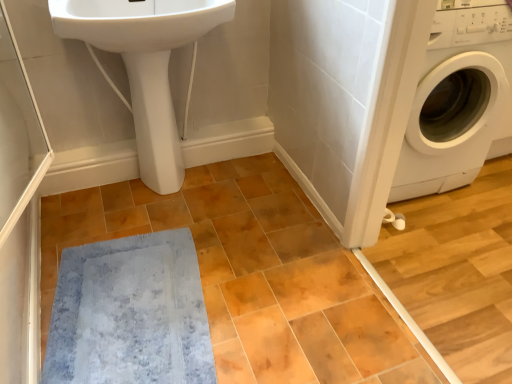
Find the location of a particular element. Image resolution: width=512 pixels, height=384 pixels. white glossy washing machine at right is located at coordinates click(x=457, y=98).

What do you see at coordinates (155, 121) in the screenshot?
I see `white glossy bidet at lower left` at bounding box center [155, 121].

Locate an element on the screen. white glossy washing machine at right is located at coordinates (457, 98).

Between blue plush bath mat at lower left and white glossy bidet at lower left, which one appears on the right side from the viewer's perspective?

white glossy bidet at lower left.

Can you tell me how much blue plush bath mat at lower left and white glossy bidet at lower left differ in facing direction?

They differ by 88.4 degrees in their facing directions.

Considering the sizes of blue plush bath mat at lower left and white glossy bidet at lower left in the image, is blue plush bath mat at lower left bigger or smaller than white glossy bidet at lower left?

In the image, blue plush bath mat at lower left appears to be smaller than white glossy bidet at lower left.

Is blue plush bath mat at lower left taller than white glossy bidet at lower left?

Incorrect, the height of blue plush bath mat at lower left is not larger of that of white glossy bidet at lower left.

In terms of size, does white glossy sink at upper left appear bigger or smaller than white glossy washing machine at right?

In the image, white glossy sink at upper left appears to be smaller than white glossy washing machine at right.

Between white glossy sink at upper left and white glossy washing machine at right, which one has larger width?

Wider between the two is white glossy washing machine at right.

Based on the photo, from the image's perspective, is white glossy sink at upper left under white glossy washing machine at right?

No, from the image's perspective, white glossy sink at upper left is not beneath white glossy washing machine at right.

From a real-world perspective, is white glossy sink at upper left above or below white glossy washing machine at right?

From a real-world perspective, white glossy sink at upper left is physically above white glossy washing machine at right.

Is blue plush bath mat at lower left a part of white glossy sink at upper left?

Definitely not — blue plush bath mat at lower left is not inside white glossy sink at upper left.

From the image's perspective, between white glossy sink at upper left and blue plush bath mat at lower left, which one is located above?

white glossy sink at upper left appears higher in the image.

Is white glossy sink at upper left facing away from blue plush bath mat at lower left?

That's not correct — white glossy sink at upper left is not looking away from blue plush bath mat at lower left.

In terms of width, does white glossy sink at upper left look wider or thinner when compared to blue plush bath mat at lower left?

white glossy sink at upper left is thinner than blue plush bath mat at lower left.

Can you tell me how much white glossy washing machine at right and blue plush bath mat at lower left differ in facing direction?

They differ by 86.7 degrees in their facing directions.

In terms of height, does white glossy washing machine at right look taller or shorter compared to blue plush bath mat at lower left?

In the image, white glossy washing machine at right appears to be taller than blue plush bath mat at lower left.

From the image's perspective, would you say white glossy washing machine at right is positioned over blue plush bath mat at lower left?

Indeed, from the image's perspective, white glossy washing machine at right is shown above blue plush bath mat at lower left.

Between white glossy bidet at lower left and blue plush bath mat at lower left, which one has smaller width?

white glossy bidet at lower left.

Considering the relative positions of white glossy bidet at lower left and blue plush bath mat at lower left in the image provided, is white glossy bidet at lower left to the left of blue plush bath mat at lower left from the viewer's perspective?

In fact, white glossy bidet at lower left is to the right of blue plush bath mat at lower left.

From a real-world perspective, which object stands above the other?

white glossy bidet at lower left, from a real-world perspective.

Considering the sizes of objects white glossy bidet at lower left and blue plush bath mat at lower left in the image provided, who is taller, white glossy bidet at lower left or blue plush bath mat at lower left?

With more height is white glossy bidet at lower left.

The height and width of the screenshot is (384, 512). Identify the location of bidet behind the white glossy washing machine at right. (155, 121).

Can you confirm if white glossy washing machine at right is smaller than white glossy bidet at lower left?

Actually, white glossy washing machine at right might be larger than white glossy bidet at lower left.

Between white glossy washing machine at right and white glossy bidet at lower left, which one has less height?

white glossy bidet at lower left is shorter.

Is white glossy washing machine at right looking in the opposite direction of white glossy bidet at lower left?

No, white glossy washing machine at right's orientation is not away from white glossy bidet at lower left.

Is blue plush bath mat at lower left smaller than white glossy sink at upper left?

Correct, blue plush bath mat at lower left occupies less space than white glossy sink at upper left.

From the image's perspective, who appears lower, blue plush bath mat at lower left or white glossy sink at upper left?

blue plush bath mat at lower left, from the image's perspective.

How many degrees apart are the facing directions of blue plush bath mat at lower left and white glossy sink at upper left?

There is a 86.5-degree angle between the facing directions of blue plush bath mat at lower left and white glossy sink at upper left.

Find the location of a particular element. The image size is (512, 384). sink above the blue plush bath mat at lower left (from a real-world perspective) is located at coordinates (138, 22).

Identify the location of bath mat in front of the white glossy bidet at lower left. Image resolution: width=512 pixels, height=384 pixels. (130, 313).

Image resolution: width=512 pixels, height=384 pixels. What are the coordinates of `sink above the white glossy washing machine at right (from a real-world perspective)` in the screenshot? It's located at (138, 22).

Looking at the image, which one is located closer to white glossy washing machine at right, blue plush bath mat at lower left or white glossy sink at upper left?

The object closer to white glossy washing machine at right is white glossy sink at upper left.

Which object lies further to the anchor point white glossy washing machine at right, white glossy bidet at lower left or white glossy sink at upper left?

white glossy bidet at lower left.

Looking at the image, which one is located further to white glossy sink at upper left, blue plush bath mat at lower left or white glossy washing machine at right?

white glossy washing machine at right.

From the image, which object appears to be nearer to white glossy sink at upper left, white glossy washing machine at right or blue plush bath mat at lower left?

blue plush bath mat at lower left is closer to white glossy sink at upper left.

Considering their positions, is white glossy sink at upper left positioned closer to white glossy washing machine at right than blue plush bath mat at lower left?

white glossy sink at upper left lies closer to white glossy washing machine at right than the other object.

When comparing their distances from blue plush bath mat at lower left, does white glossy washing machine at right or white glossy bidet at lower left seem further?

Among the two, white glossy washing machine at right is located further to blue plush bath mat at lower left.

When comparing their distances from white glossy washing machine at right, does white glossy bidet at lower left or blue plush bath mat at lower left seem further?

blue plush bath mat at lower left is further to white glossy washing machine at right.

Based on their spatial positions, is blue plush bath mat at lower left or white glossy bidet at lower left closer to white glossy washing machine at right?

white glossy bidet at lower left is closer to white glossy washing machine at right.

Locate an element on the screen. This screenshot has width=512, height=384. bidet between white glossy sink at upper left and blue plush bath mat at lower left in the vertical direction is located at coordinates (155, 121).

Locate an element on the screen. The width and height of the screenshot is (512, 384). sink between blue plush bath mat at lower left and white glossy washing machine at right is located at coordinates (138, 22).

You are a GUI agent. You are given a task and a screenshot of the screen. Output one action in this format:
    pyautogui.click(x=<x>, y=<y>)
    Task: Click on the sink between white glossy bidet at lower left and white glossy washing machine at right in the horizontal direction
    The image size is (512, 384).
    Given the screenshot: What is the action you would take?
    pyautogui.click(x=138, y=22)

You are a GUI agent. You are given a task and a screenshot of the screen. Output one action in this format:
    pyautogui.click(x=<x>, y=<y>)
    Task: Click on the bidet situated between blue plush bath mat at lower left and white glossy washing machine at right from left to right
    The height and width of the screenshot is (384, 512).
    Given the screenshot: What is the action you would take?
    pyautogui.click(x=155, y=121)